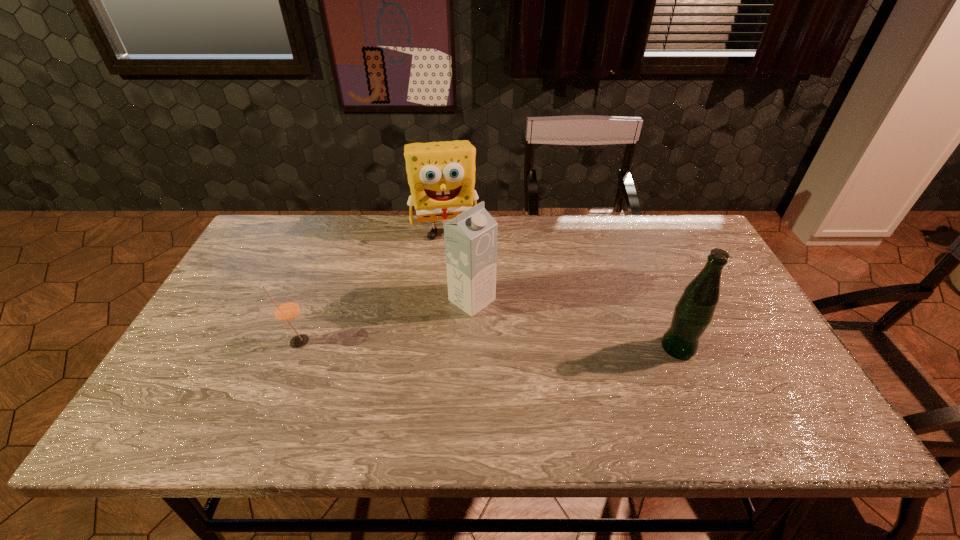
The height and width of the screenshot is (540, 960). I want to click on free space on the desktop that is between the straw and the beer bottle and is positioned on the front label of the carton, so point(537,346).

Locate an element on the screen. vacant space on the desktop that is between the straw and the beer bottle and is positioned on the face of the farthest object is located at coordinates (466, 344).